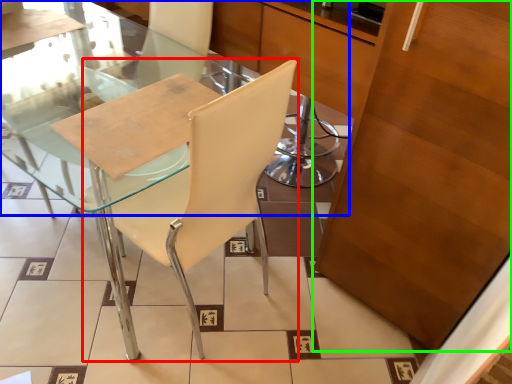
Question: Estimate the real-world distances between objects in this image. Which object is farther from chair (highlighted by a red box), glass table (highlighted by a blue box) or cabinetry (highlighted by a green box)?

Choices:
 (A) glass table
 (B) cabinetry

Answer: (A)